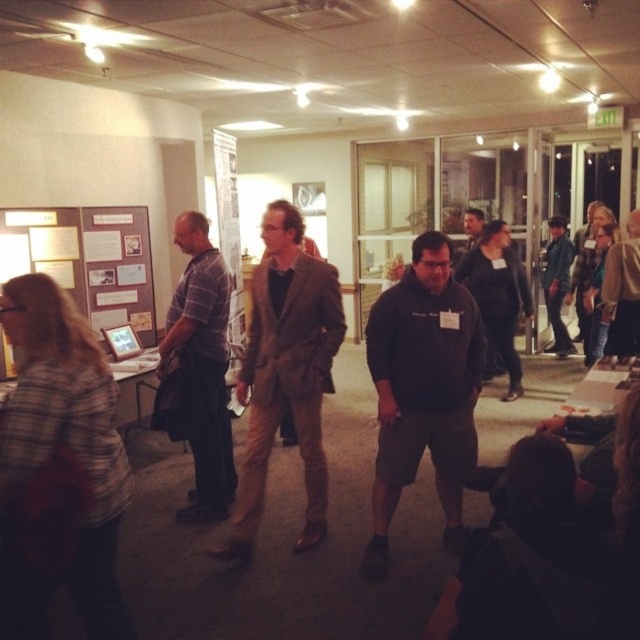
You are organizing a clothing donation drive and need to determine if the brown wool blazer at center and the denim jacket at right can fit into a standard donation box that measures 30x30x30 cm. Can both items fit together in the box?

The brown wool blazer at center is bigger than the denim jacket at right. Since the box is 30x30x30 cm, it depends on the exact dimensions of each jacket. If the combined volume of both jackets does not exceed the box volume, they can fit. However, if the larger blazer alone exceeds the box dimensions, it might not fit even without the smaller jacket.

You are standing in the conference room and want to move from the point at coordinates (284, 250) to the point at (624, 273). Which direction should you move to get closer to the second point?

To move from point (284, 250) to point (624, 273), you should move downward because point (284, 250) is closer to the viewer than point (624, 273), meaning it is located further back in the room. Moving toward the lower part of the image would take you in the direction of the second point.

You are organizing a clothing donation drive and need to categorize items by size. You have a dark gray hoodie at center and a brown wool blazer at center. Which clothing item would you place in the large size bin?

The dark gray hoodie at center is bigger than the brown wool blazer at center, so it should be placed in the large size bin.